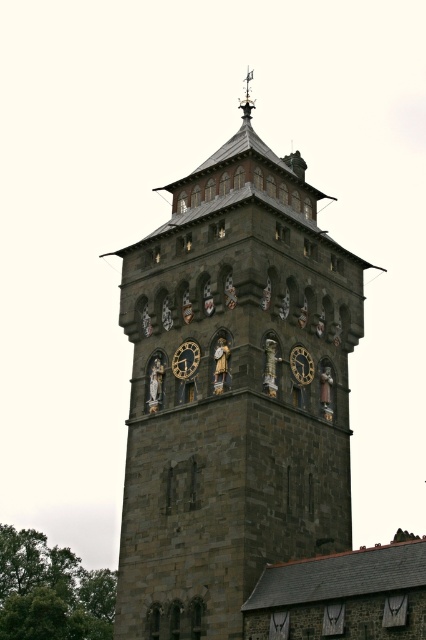
You are standing in front of a historic building complex. You see a point marked at coordinates (x=233, y=392). What does this point most likely represent?

The point at coordinates (x=233, y=392) most likely represents the dark stone clock tower at center, as it is centrally located in the image.

You are an architect examining the image of a historic building. You notice two clock structures at the center of the tower. Which one is taller, the dark stone clock tower at center or the dark brown stone clock at center?

The dark stone clock tower at center is taller than the dark brown stone clock at center.